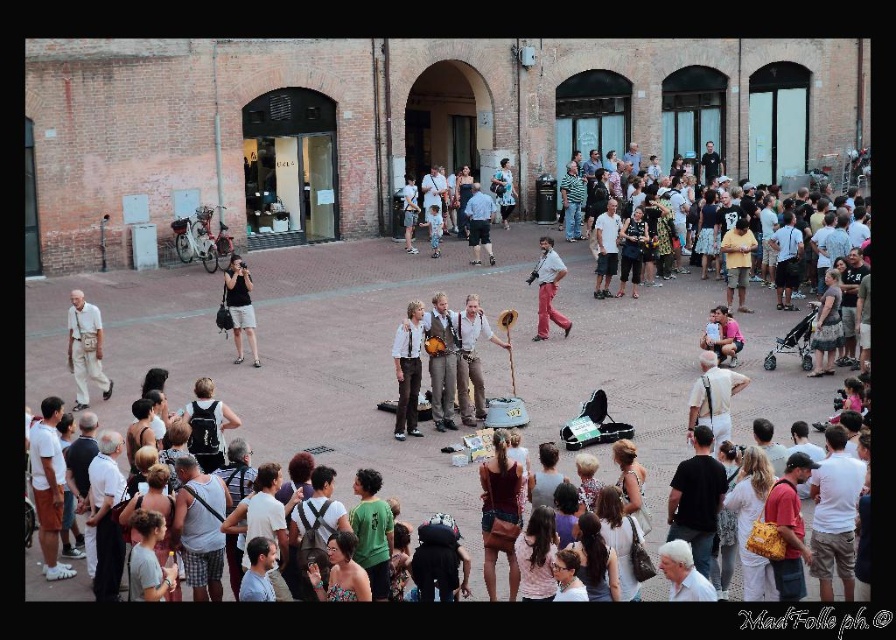
You are a photographer positioned at the center of the square. You want to capture a photo of the light brown leather jacket at center. According to the coordinates provided, in which direction should you aim your camera relative to your position?

The light brown leather jacket at center is located at coordinates point (408, 369), which means it is slightly to the right and above your position. Aim your camera in that direction.

What color are the pants located at the point with coordinates (x=85, y=348)?

The pants at point (x=85, y=348) are light beige in color.